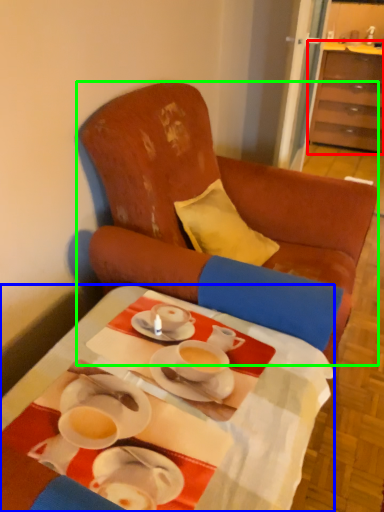
Question: Based on their relative distances, which object is farther from cabinetry (highlighted by a red box)? Choose from desk (highlighted by a blue box) and chair (highlighted by a green box).

Choices:
 (A) desk
 (B) chair

Answer: (A)